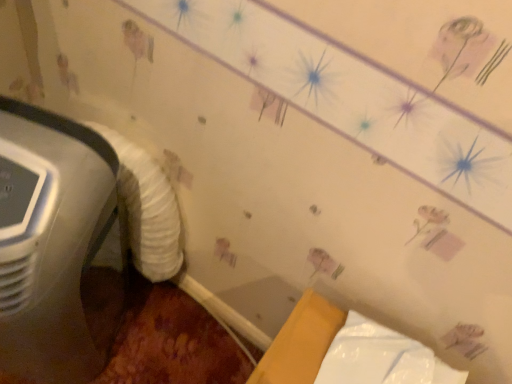
Question: Is point (33, 322) positioned closer to the camera than point (150, 233)?

Choices:
 (A) farther
 (B) closer

Answer: (B)

Question: Choose the correct answer: Is white plastic air conditioner at left inside white fluffy sheet at left or outside it?

Choices:
 (A) outside
 (B) inside

Answer: (A)

Question: Which object is positioned closest to the white fluffy sheet at left?

Choices:
 (A) white glossy wrapping paper at lower right
 (B) white plastic air conditioner at left

Answer: (B)

Question: Which object is positioned closest to the white plastic air conditioner at left?

Choices:
 (A) white glossy wrapping paper at lower right
 (B) white fluffy sheet at left

Answer: (B)